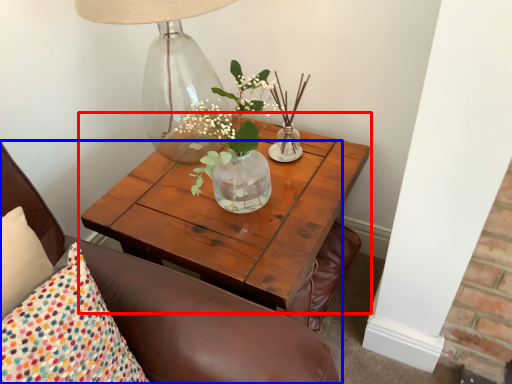
Question: Which object is closer to the camera taking this photo, coffee table (highlighted by a red box) or chair (highlighted by a blue box)?

Choices:
 (A) coffee table
 (B) chair

Answer: (B)